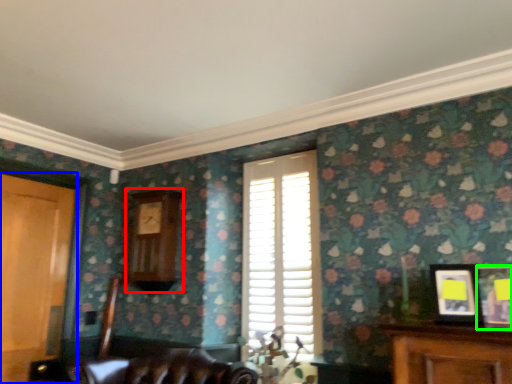
Question: Estimate the real-world distances between objects in this image. Which object is farther from clock (highlighted by a red box), door (highlighted by a blue box) or picture frame (highlighted by a green box)?

Choices:
 (A) door
 (B) picture frame

Answer: (B)